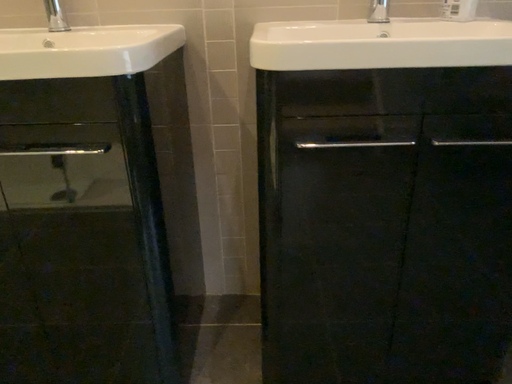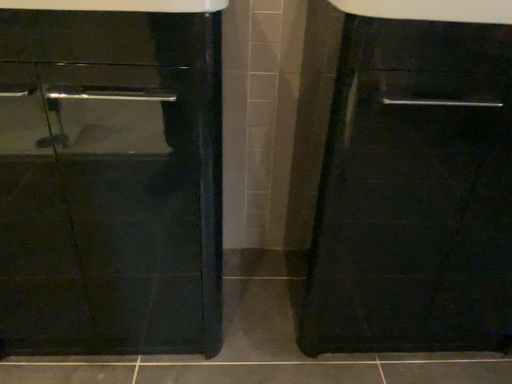
Question: Which way did the camera rotate in the video?

Choices:
 (A) rotated downward
 (B) rotated upward

Answer: (A)